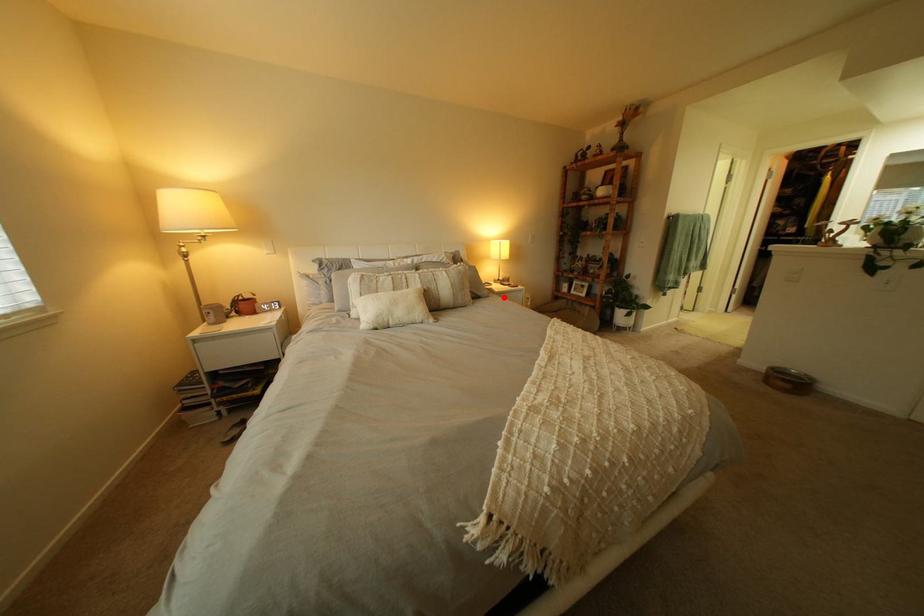
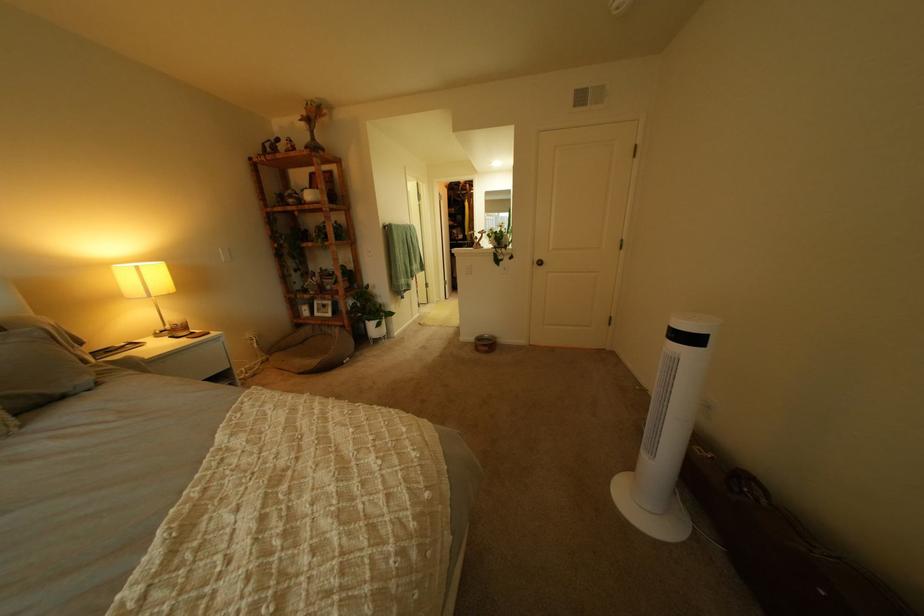
Locate, in the second image, the point that corresponds to the highlighted location in the first image.

(115, 385)